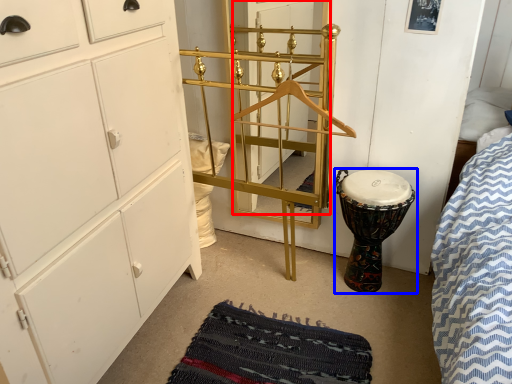
Question: Among these objects, which one is nearest to the camera, door (highlighted by a red box) or drum (highlighted by a blue box)?

Choices:
 (A) door
 (B) drum

Answer: (B)